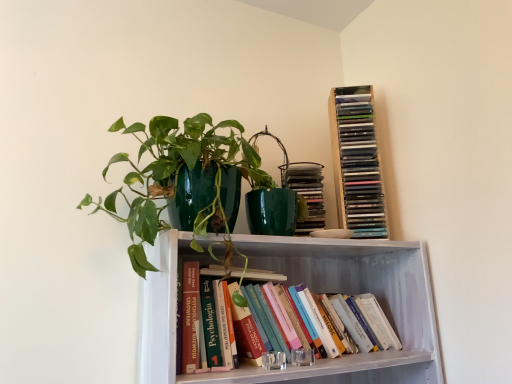
Question: In the image, is hardcover book at center, marked as the 3th book in a top-to-bottom arrangement, positioned in front of or behind matte green book at upper right, marked as the third book in a bottom-to-top arrangement?

Choices:
 (A) front
 (B) behind

Answer: (A)

Question: Is hardcover book at center, which is the 2th book in bottom-to-top order, inside the boundaries of matte green book at upper right, acting as the 2th book starting from the top, or outside?

Choices:
 (A) outside
 (B) inside

Answer: (A)

Question: Estimate the real-world distances between objects in this image. Which object is farther from the green glossy pot at upper center?

Choices:
 (A) hardcover book at center, which is the 2th book in bottom-to-top order
 (B) hardcover books at center, positioned as the 4th book in top-to-bottom order
 (C) matte green book at upper right, acting as the 2th book starting from the top
 (D) wooden cd tower at upper right, marked as the 4th book in a bottom-to-top arrangement

Answer: (D)

Question: Considering the real-world distances, which object is farthest from the hardcover books at center, positioned as the 4th book in top-to-bottom order?

Choices:
 (A) matte green book at upper right, acting as the 2th book starting from the top
 (B) green glossy pot at upper center
 (C) wooden cd tower at upper right, marked as the 4th book in a bottom-to-top arrangement
 (D) hardcover book at center, marked as the 3th book in a top-to-bottom arrangement

Answer: (B)